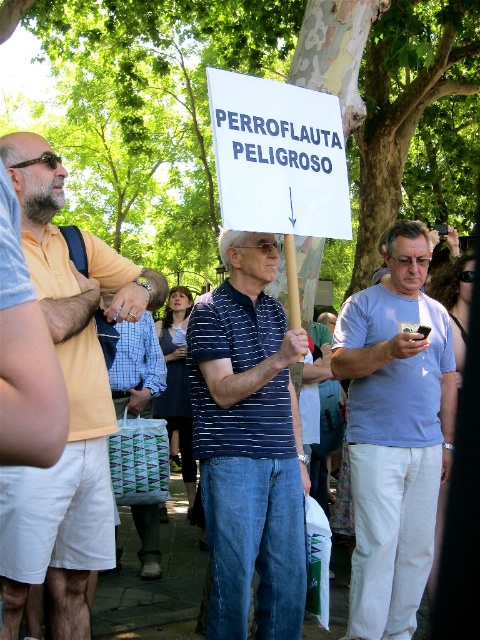
Is matte yellow shirt at left further to the viewer compared to blue striped shirt at center?

No, it is in front of blue striped shirt at center.

Does point (25, 595) come in front of point (120, 401)?

Yes, it is.

Is point (121, 275) behind point (156, 376)?

That is False.

Find the location of a particular element. The height and width of the screenshot is (640, 480). matte yellow shirt at left is located at coordinates (69, 404).

Is blue striped polo shirt at center closer to the viewer compared to light blue cotton shirt at center?

Yes, it is in front of light blue cotton shirt at center.

Looking at this image, can you confirm if blue striped polo shirt at center is positioned below light blue cotton shirt at center?

No.

Locate an element on the screen. Image resolution: width=480 pixels, height=640 pixels. blue striped polo shirt at center is located at coordinates (249, 444).

Can you confirm if matte yellow shirt at left is positioned below light blue cotton shirt at center?

Actually, matte yellow shirt at left is above light blue cotton shirt at center.

Between matte yellow shirt at left and light blue cotton shirt at center, which one is positioned higher?

matte yellow shirt at left is higher up.

Does point (36, 237) lie behind point (455, 368)?

No, (36, 237) is closer to viewer.

You are a GUI agent. You are given a task and a screenshot of the screen. Output one action in this format:
    pyautogui.click(x=<x>, y=<y>)
    Task: Click on the matte yellow shirt at left
    
    Given the screenshot: What is the action you would take?
    pyautogui.click(x=69, y=404)